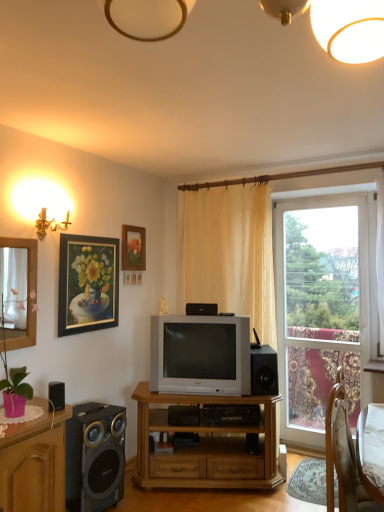
Question: Considering the relative sizes of matte wooden picture frame at upper center, the first picture frame positioned from the back, and clear glass window at right in the image provided, is matte wooden picture frame at upper center, the first picture frame positioned from the back, bigger than clear glass window at right?

Choices:
 (A) no
 (B) yes

Answer: (A)

Question: Is there a large distance between matte wooden picture frame at upper center, the first picture frame positioned from the back, and clear glass window at right?

Choices:
 (A) no
 (B) yes

Answer: (B)

Question: Can clear glass window at right be found inside matte wooden picture frame at upper center, acting as the 2th picture frame starting from the front?

Choices:
 (A) no
 (B) yes

Answer: (A)

Question: Is matte wooden picture frame at upper center, which is the second picture frame from left to right, closer to camera compared to clear glass window at right?

Choices:
 (A) no
 (B) yes

Answer: (A)

Question: Is matte wooden picture frame at upper center, which is the 1th picture frame in right-to-left order, wider than clear glass window at right?

Choices:
 (A) yes
 (B) no

Answer: (B)

Question: Which is correct: gold-framed painting at upper left, which is the second picture frame from right to left, is inside silver metallic television at center, or outside of it?

Choices:
 (A) inside
 (B) outside

Answer: (B)

Question: In terms of size, does gold-framed painting at upper left, the 1th picture frame when ordered from front to back, appear bigger or smaller than silver metallic television at center?

Choices:
 (A) small
 (B) big

Answer: (A)

Question: From the image's perspective, is gold-framed painting at upper left, the 1th picture frame when ordered from front to back, located above or below silver metallic television at center?

Choices:
 (A) below
 (B) above

Answer: (B)

Question: Considering the positions of gold-framed painting at upper left, the second picture frame when ordered from back to front, and silver metallic television at center in the image, is gold-framed painting at upper left, the second picture frame when ordered from back to front, taller or shorter than silver metallic television at center?

Choices:
 (A) tall
 (B) short

Answer: (A)

Question: Looking at their shapes, would you say wooden cabinet at lower left is wider or thinner than gold-framed painting at upper left, the 1th picture frame when ordered from front to back?

Choices:
 (A) wide
 (B) thin

Answer: (A)

Question: From the image's perspective, is wooden cabinet at lower left above or below gold-framed painting at upper left, the second picture frame when ordered from back to front?

Choices:
 (A) above
 (B) below

Answer: (B)

Question: From a real-world perspective, is wooden cabinet at lower left physically located above or below gold-framed painting at upper left, which is the second picture frame from right to left?

Choices:
 (A) below
 (B) above

Answer: (A)

Question: In terms of height, does wooden cabinet at lower left look taller or shorter compared to gold-framed painting at upper left, which is the 1th picture frame in left-to-right order?

Choices:
 (A) short
 (B) tall

Answer: (B)

Question: Does point (248, 470) appear closer or farther from the camera than point (193, 309)?

Choices:
 (A) farther
 (B) closer

Answer: (B)

Question: From a real-world perspective, is wooden tv stand at center above or below black plastic speaker at center, which is the 1th speaker in back-to-front order?

Choices:
 (A) below
 (B) above

Answer: (A)